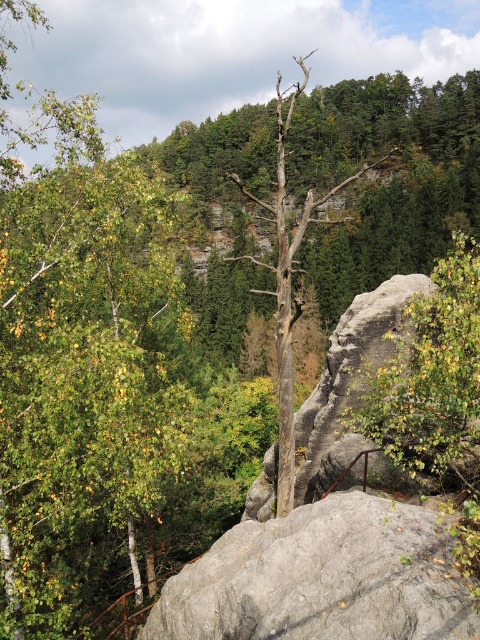
You are planning to place a small bench between the gray rough boulder at center and the green leafy shrub at right. Based on their sizes, which object should the bench be closer to?

The bench should be closer to the gray rough boulder at center because it occupies less space than the green leafy shrub at right, allowing more room for the bench near the shrub.